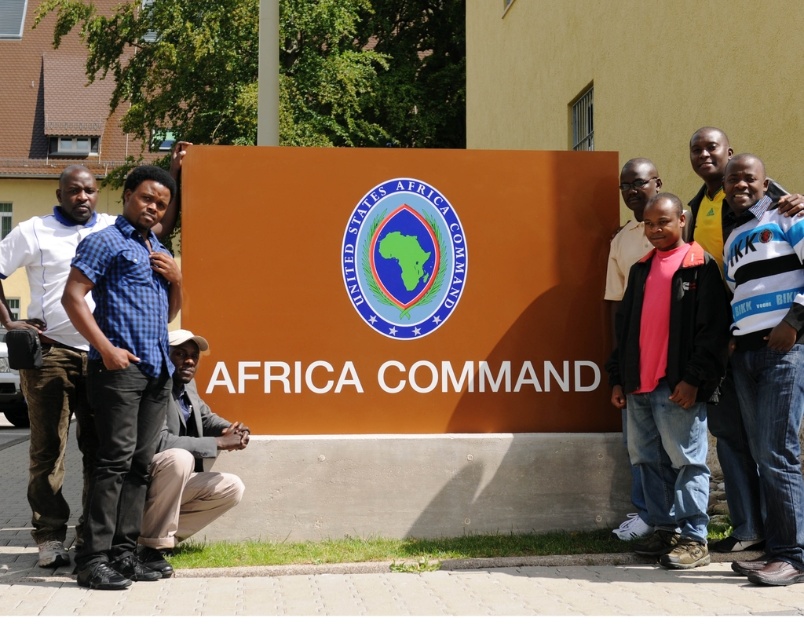
You are a photographer trying to capture a photo of the orange matte sign at center and the khaki fabric pants at lower center. The camera you are using has a minimum focus distance of 3 feet. Can you focus on both objects simultaneously without moving the camera?

The orange matte sign at center and khaki fabric pants at lower center are 3.61 feet apart. Since the distance between them is greater than the camera minimum focus distance of 3 feet, you can focus on both objects simultaneously without moving the camera.